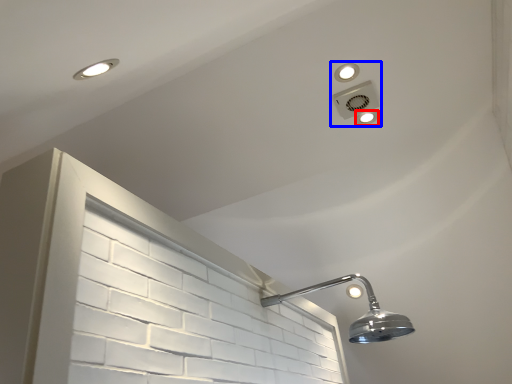
Question: Which object appears closest to the camera in this image, dot (highlighted by a red box) or fixture (highlighted by a blue box)?

Choices:
 (A) dot
 (B) fixture

Answer: (B)